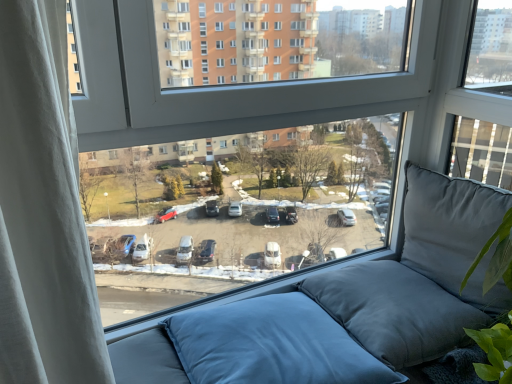
Question: Is matte gray cushion at right, positioned as the second pillow in left-to-right order, at the left side of blue fabric pillow at lower center, which ranks as the 2th pillow in right-to-left order?

Choices:
 (A) no
 (B) yes

Answer: (A)

Question: Does matte gray cushion at right, positioned as the second pillow in left-to-right order, come behind blue fabric pillow at lower center, which ranks as the 2th pillow in right-to-left order?

Choices:
 (A) no
 (B) yes

Answer: (B)

Question: Can you confirm if matte gray cushion at right, marked as the 1th pillow in a right-to-left arrangement, is taller than blue fabric pillow at lower center, which ranks as the 2th pillow in right-to-left order?

Choices:
 (A) no
 (B) yes

Answer: (B)

Question: Considering the relative sizes of matte gray cushion at right, positioned as the second pillow in left-to-right order, and blue fabric pillow at lower center, the first pillow from the left, in the image provided, is matte gray cushion at right, positioned as the second pillow in left-to-right order, thinner than blue fabric pillow at lower center, the first pillow from the left,?

Choices:
 (A) no
 (B) yes

Answer: (B)

Question: Could you tell me if matte gray cushion at right, positioned as the second pillow in left-to-right order, is turned towards blue fabric pillow at lower center, the first pillow from the left?

Choices:
 (A) yes
 (B) no

Answer: (A)

Question: Is matte gray cushion at right, positioned as the second pillow in left-to-right order, turned away from blue fabric pillow at lower center, the first pillow from the left?

Choices:
 (A) no
 (B) yes

Answer: (A)

Question: Can matte gray cushion at right, positioned as the second pillow in left-to-right order, be found inside transparent glass window at center?

Choices:
 (A) no
 (B) yes

Answer: (A)

Question: Is transparent glass window at center facing away from matte gray cushion at right, positioned as the second pillow in left-to-right order?

Choices:
 (A) yes
 (B) no

Answer: (A)

Question: Does transparent glass window at center appear on the left side of matte gray cushion at right, positioned as the second pillow in left-to-right order?

Choices:
 (A) yes
 (B) no

Answer: (A)

Question: Is transparent glass window at center positioned far away from matte gray cushion at right, marked as the 1th pillow in a right-to-left arrangement?

Choices:
 (A) yes
 (B) no

Answer: (B)

Question: Is transparent glass window at center aimed at matte gray cushion at right, positioned as the second pillow in left-to-right order?

Choices:
 (A) no
 (B) yes

Answer: (B)

Question: From the image's perspective, does transparent glass window at center appear higher than matte gray cushion at right, positioned as the second pillow in left-to-right order?

Choices:
 (A) yes
 (B) no

Answer: (A)

Question: From the image's perspective, is transparent glass window at center under blue fabric pillow at lower center, which ranks as the 2th pillow in right-to-left order?

Choices:
 (A) no
 (B) yes

Answer: (A)